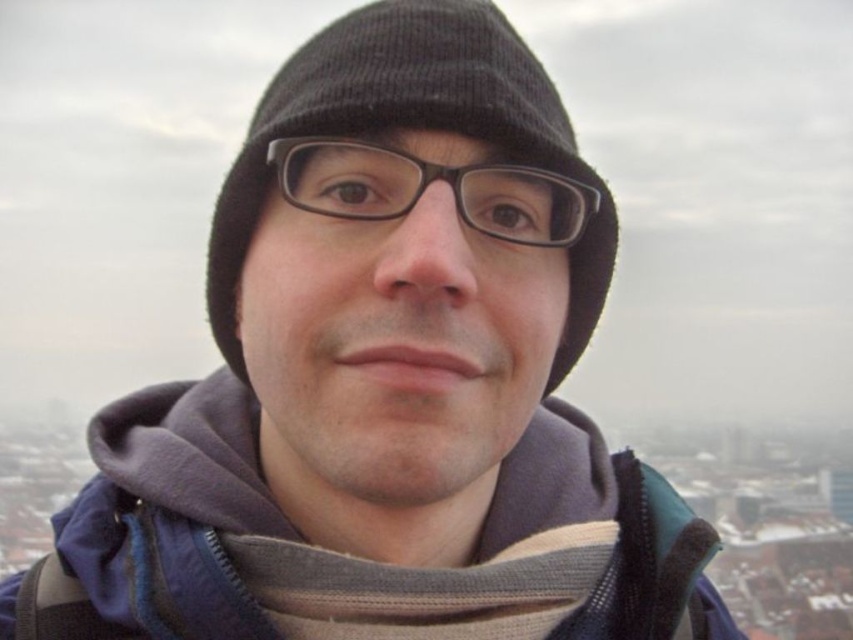
What do you see at coordinates (344, 540) in the screenshot? The width and height of the screenshot is (853, 640). I see `navy blue fleece jacket at center` at bounding box center [344, 540].

In the scene shown: Which is more to the left, navy blue fleece jacket at center or black knit hat at center?

Positioned to the left is navy blue fleece jacket at center.

Is point (106, 529) positioned behind point (505, 128)?

Yes, point (106, 529) is farther from viewer.

Locate an element on the screen. The image size is (853, 640). navy blue fleece jacket at center is located at coordinates (344, 540).